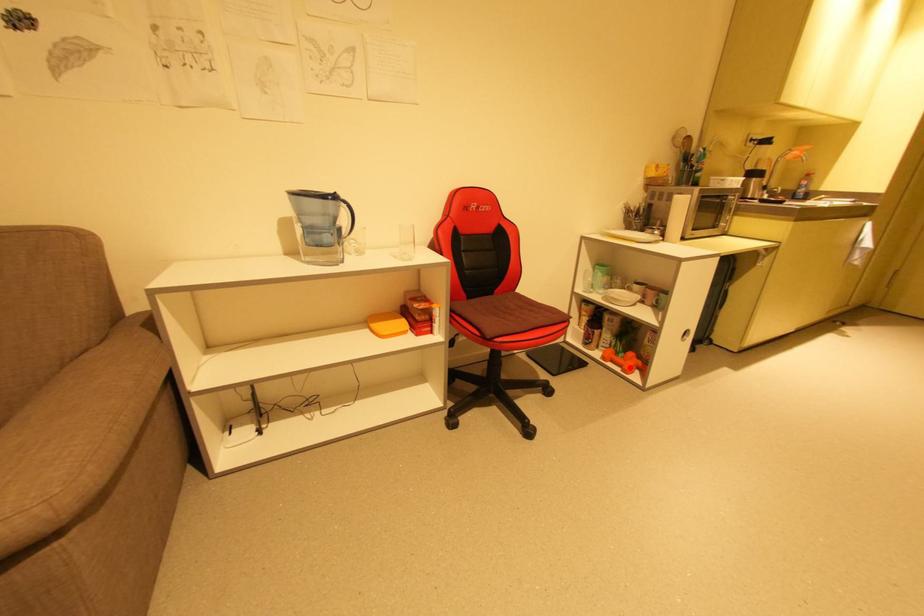
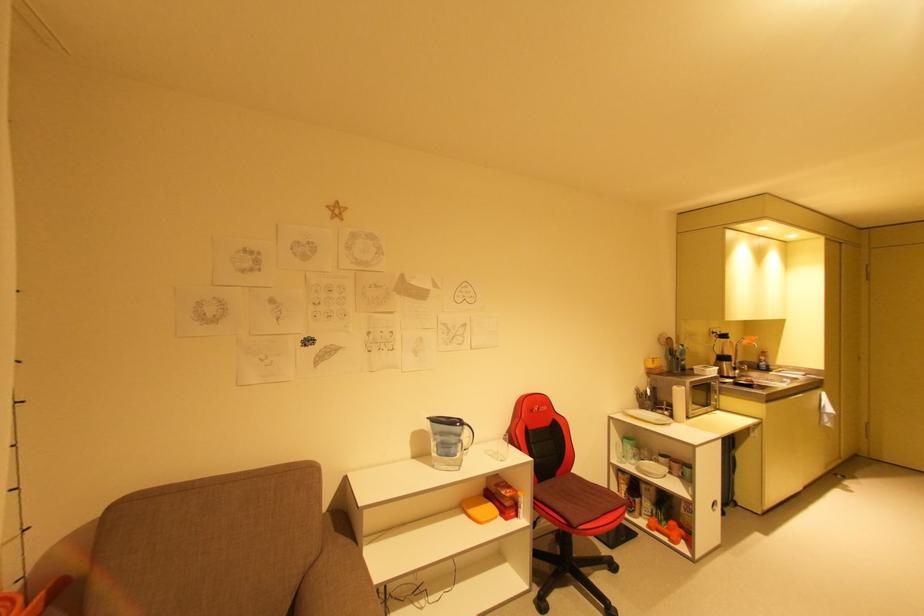
Locate, in the second image, the point that corresponds to the highlighted location in the first image.

(675, 538)